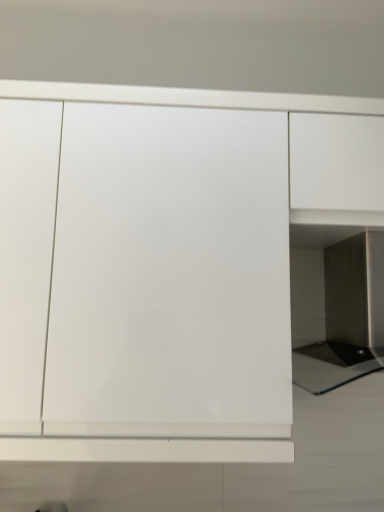
Locate an element on the screen. This screenshot has width=384, height=512. metallic silver oven at right is located at coordinates (337, 312).

What do you see at coordinates (337, 312) in the screenshot? I see `metallic silver oven at right` at bounding box center [337, 312].

Where is `metallic silver oven at right`? The height and width of the screenshot is (512, 384). metallic silver oven at right is located at coordinates (337, 312).